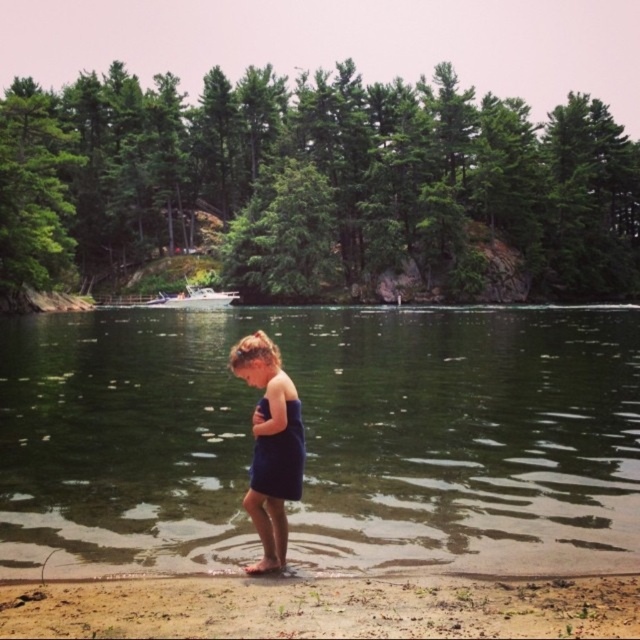
Question: Which point is farther to the camera?

Choices:
 (A) blue fabric dress at center
 (B) clear water at lower center
 (C) sandy shore at lower center
 (D) blue towel at center

Answer: (B)

Question: Does blue towel at center appear under blue fabric dress at center?

Choices:
 (A) no
 (B) yes

Answer: (B)

Question: Which of the following is the farthest from the observer?

Choices:
 (A) [268, 449]
 (B) [417, 504]
 (C) [298, 416]
 (D) [362, 580]

Answer: (B)

Question: Does clear water at lower center appear under blue fabric dress at center?

Choices:
 (A) no
 (B) yes

Answer: (B)

Question: Which point is farther from the camera taking this photo?

Choices:
 (A) (429, 456)
 (B) (282, 369)

Answer: (A)

Question: Does clear water at lower center appear over sandy shore at lower center?

Choices:
 (A) yes
 (B) no

Answer: (A)